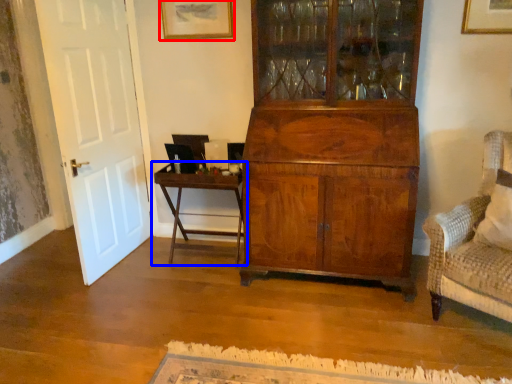
Question: Which object is closer to the camera taking this photo, picture frame (highlighted by a red box) or table (highlighted by a blue box)?

Choices:
 (A) picture frame
 (B) table

Answer: (B)